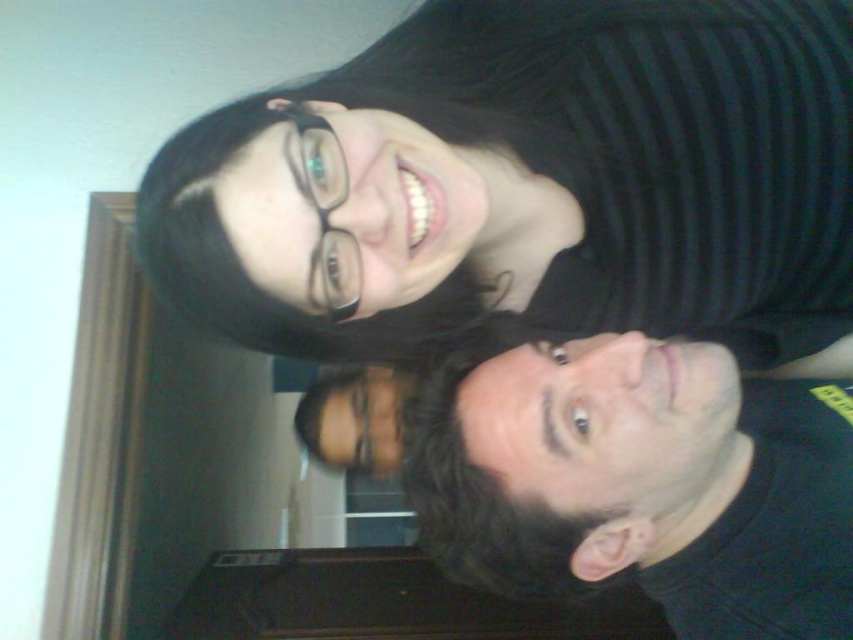
Between black striped shirt at upper center and black matte face at lower right, which one appears on the left side from the viewer's perspective?

From the viewer's perspective, black striped shirt at upper center appears more on the left side.

Can you confirm if black striped shirt at upper center is positioned to the right of black matte face at lower right?

In fact, black striped shirt at upper center is to the left of black matte face at lower right.

Locate an element on the screen. Image resolution: width=853 pixels, height=640 pixels. black striped shirt at upper center is located at coordinates (576, 170).

Where is `black striped shirt at upper center`? black striped shirt at upper center is located at coordinates (576, 170).